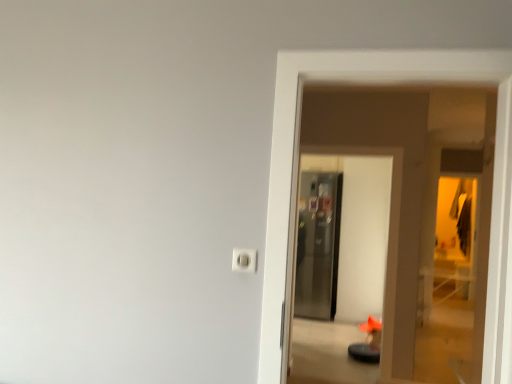
Question: Based on their sizes in the image, would you say white plastic outlet at center is bigger or smaller than satin metallic refrigerator at center, which is counted as the second screen door, starting from the back?

Choices:
 (A) small
 (B) big

Answer: (A)

Question: Considering the relative positions of white plastic outlet at center and satin metallic refrigerator at center, which is counted as the second screen door, starting from the back, in the image provided, is white plastic outlet at center to the left or to the right of satin metallic refrigerator at center, which is counted as the second screen door, starting from the back,?

Choices:
 (A) right
 (B) left

Answer: (B)

Question: Which of these objects is positioned farthest from the white plastic outlet at center?

Choices:
 (A) metallic glass screen door at center, which appears as the second screen door when viewed from the front
 (B) satin metallic refrigerator at center, placed as the 1th screen door when sorted from front to back

Answer: (A)

Question: Based on their relative distances, which object is farther from the metallic glass screen door at center, arranged as the first screen door when viewed from the back?

Choices:
 (A) satin metallic refrigerator at center, placed as the 1th screen door when sorted from front to back
 (B) white plastic outlet at center

Answer: (B)